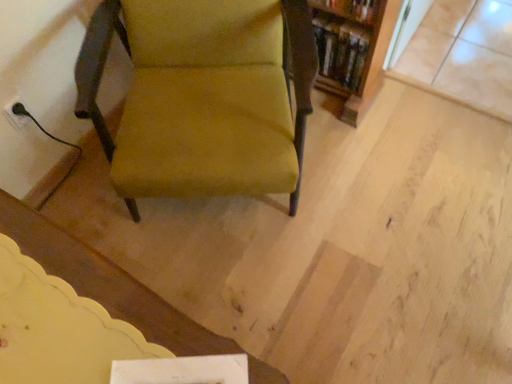
Question: Would you consider wooden bookshelf at upper right to be distant from velvet mustard chair at center?

Choices:
 (A) no
 (B) yes

Answer: (A)

Question: Is wooden bookshelf at upper right wider than velvet mustard chair at center?

Choices:
 (A) no
 (B) yes

Answer: (A)

Question: Is wooden bookshelf at upper right positioned before velvet mustard chair at center?

Choices:
 (A) yes
 (B) no

Answer: (B)

Question: From a real-world perspective, is wooden bookshelf at upper right on velvet mustard chair at center?

Choices:
 (A) yes
 (B) no

Answer: (B)

Question: Is wooden bookshelf at upper right oriented away from velvet mustard chair at center?

Choices:
 (A) yes
 (B) no

Answer: (B)

Question: From the image's perspective, would you say wooden bookshelf at upper right is positioned over velvet mustard chair at center?

Choices:
 (A) yes
 (B) no

Answer: (A)

Question: Can you confirm if velvet mustard chair at center is wider than wooden bookshelf at upper right?

Choices:
 (A) yes
 (B) no

Answer: (A)

Question: Is velvet mustard chair at center outside wooden bookshelf at upper right?

Choices:
 (A) yes
 (B) no

Answer: (A)

Question: Is velvet mustard chair at center shorter than wooden bookshelf at upper right?

Choices:
 (A) no
 (B) yes

Answer: (A)

Question: Are velvet mustard chair at center and wooden bookshelf at upper right making contact?

Choices:
 (A) yes
 (B) no

Answer: (B)

Question: Can you confirm if velvet mustard chair at center is taller than wooden bookshelf at upper right?

Choices:
 (A) no
 (B) yes

Answer: (B)

Question: Would you say wooden bookshelf at upper right is part of velvet mustard chair at center's contents?

Choices:
 (A) yes
 (B) no

Answer: (B)

Question: From the image's perspective, relative to wooden bookshelf at upper right, is velvet mustard chair at center above or below?

Choices:
 (A) below
 (B) above

Answer: (A)